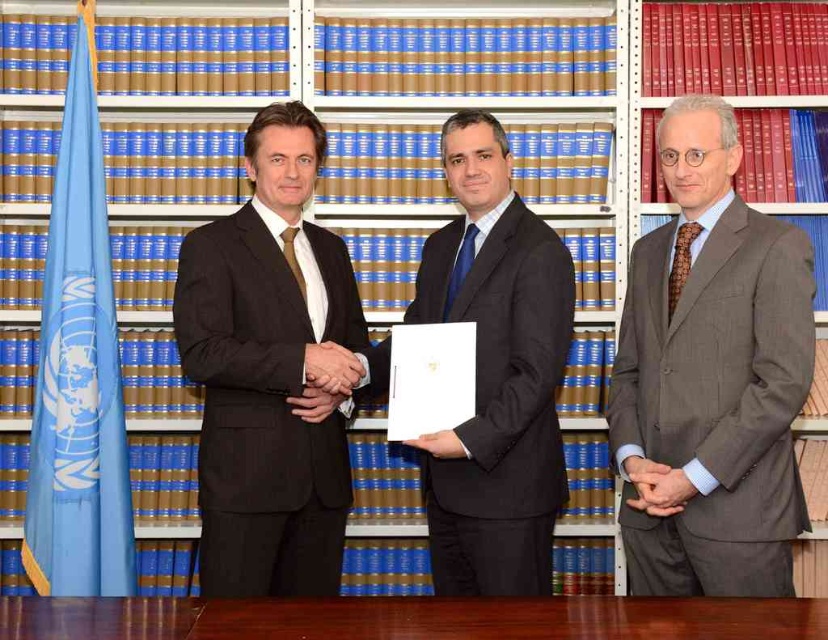
You are a server at a formal event and need to place a 30 inch long platter on the brown wooden table at center. There is a brown leather hand at center currently resting on the table. Can you safely place the platter without moving the hand?

The brown wooden table at center and brown leather hand at center are 29.94 inches apart. Since the platter is 30 inches long, it would extend beyond the available space between them, making it unsafe to place without moving the hand.

You are attending a formal event and need to place a name tag on the brown wooden table at center. However, you are currently standing next to the gray pinstripe suit at right. To reach the table, do you need to move forward or backward?

The brown wooden table at center is behind the gray pinstripe suit at right, so you need to move forward to reach the table.

Consider the image. You are a server carrying a tray of drinks. You need to place the tray on the brown wooden table at center without spilling anything. The smooth leather hand at center is currently holding a pen. Can you safely place the tray on the table without the hand getting in the way?

The distance between the brown wooden table at center and the smooth leather hand at center is 19.73 inches. Since the hand is 19.73 inches away from the table, there is enough space to place the tray safely without the hand interfering.